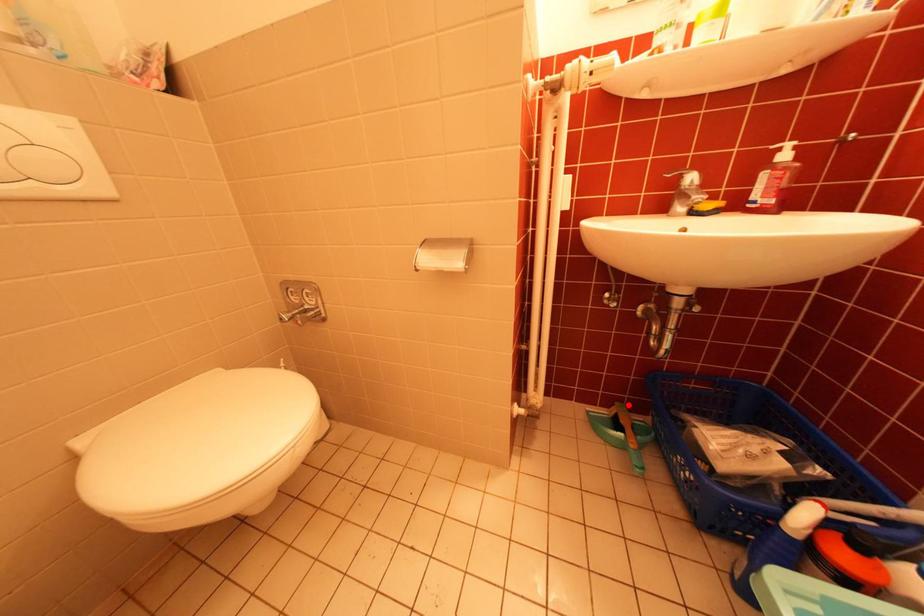
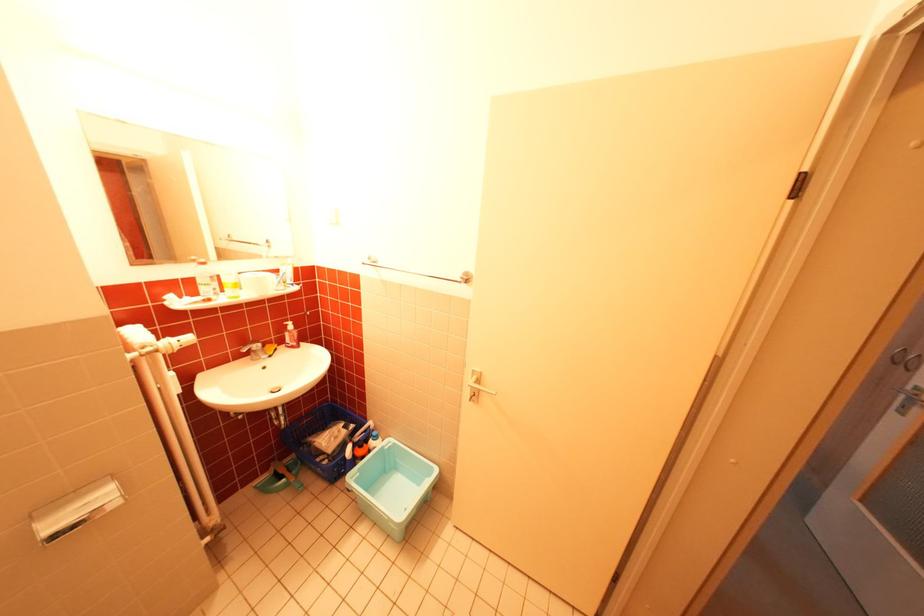
Question: I am providing you with two images of the same scene from different viewpoints. Image1 has a red point marked. In image2, the corresponding 3D location appears at what relative position? Reply with the corresponding letter.

Choices:
 (A) Closer
 (B) Farther

Answer: (A)